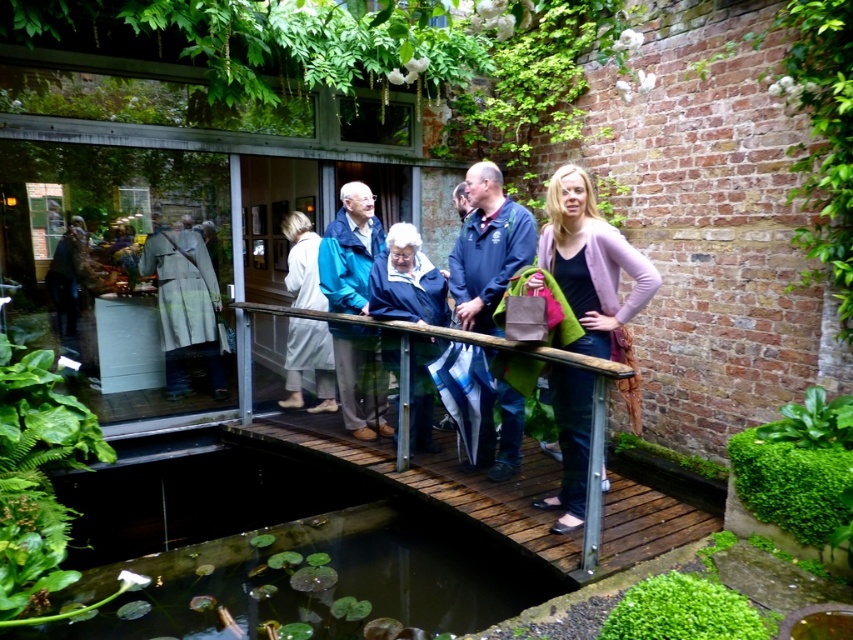
You are a fashion designer observing the group on the wooden bridge. You notice two garments at the center of the scene. Which garment has a greater width when comparing the pink wool sweater at center and the white fabric coat at center?

The pink wool sweater at center has a greater width than the white fabric coat at center according to the description.

You are standing on the wooden bridge and want to hand a note to the person wearing the pink wool sweater at center and the blue fabric jacket at center. Which one do you need to stretch your arm further to reach?

The blue fabric jacket at center is further away from you than the pink wool sweater at center, so you need to stretch your arm further to reach the blue fabric jacket at center.

You are a photographer standing on the wooden bridge in the garden. You want to capture a photo of the blue fabric jacket at center and the white fabric coat at center. The minimum distance required for your camera to focus on both subjects clearly is 30 inches. Can you take the photo without moving either jacket or coat?

The blue fabric jacket at center and white fabric coat at center are 31.24 inches apart from each other. Since the minimum focus distance required is 30 inches and the actual distance is slightly more than that, the camera should be able to capture both subjects clearly without needing to move either the jacket or coat.